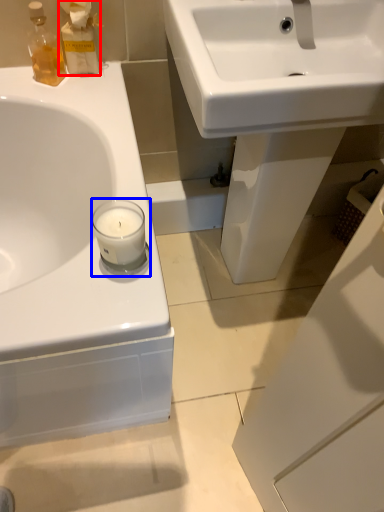
Question: Among these objects, which one is farthest to the camera, cleaning product (highlighted by a red box) or candle holder (highlighted by a blue box)?

Choices:
 (A) cleaning product
 (B) candle holder

Answer: (A)